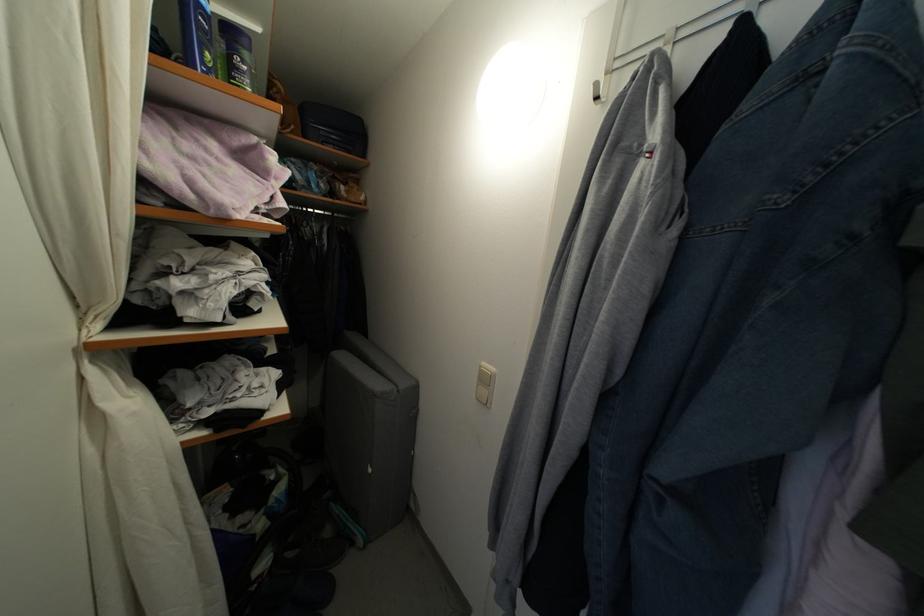
Which object does [197,34] point to?

It refers to a blue plastic bottle.